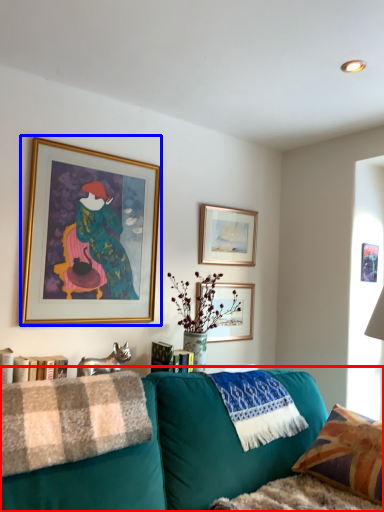
Question: Which of the following is the closest to the observer, studio couch (highlighted by a red box) or picture frame (highlighted by a blue box)?

Choices:
 (A) studio couch
 (B) picture frame

Answer: (A)